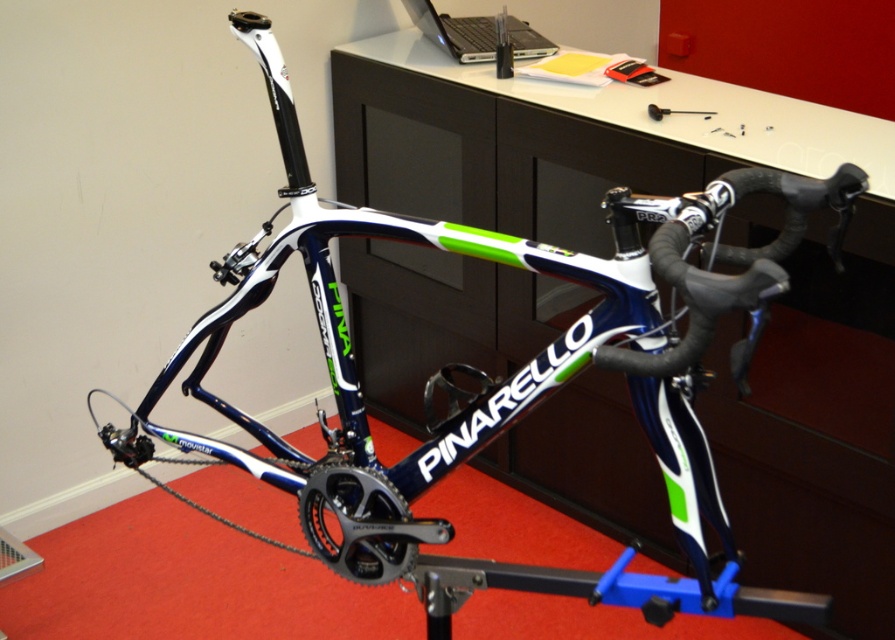
Question: Which point is closer to the camera taking this photo?

Choices:
 (A) (354, 484)
 (B) (463, 44)

Answer: (A)

Question: Which point is closer to the camera?

Choices:
 (A) silver/black laptop at upper center
 (B) black metallic gear at center

Answer: (B)

Question: Which point is farther to the camera?

Choices:
 (A) silver/black laptop at upper center
 (B) black metallic gear at center

Answer: (A)

Question: Can you confirm if black metallic gear at center is wider than silver/black laptop at upper center?

Choices:
 (A) yes
 (B) no

Answer: (B)

Question: Is black metallic gear at center positioned in front of silver/black laptop at upper center?

Choices:
 (A) yes
 (B) no

Answer: (A)

Question: Is black metallic gear at center further to camera compared to silver/black laptop at upper center?

Choices:
 (A) yes
 (B) no

Answer: (B)